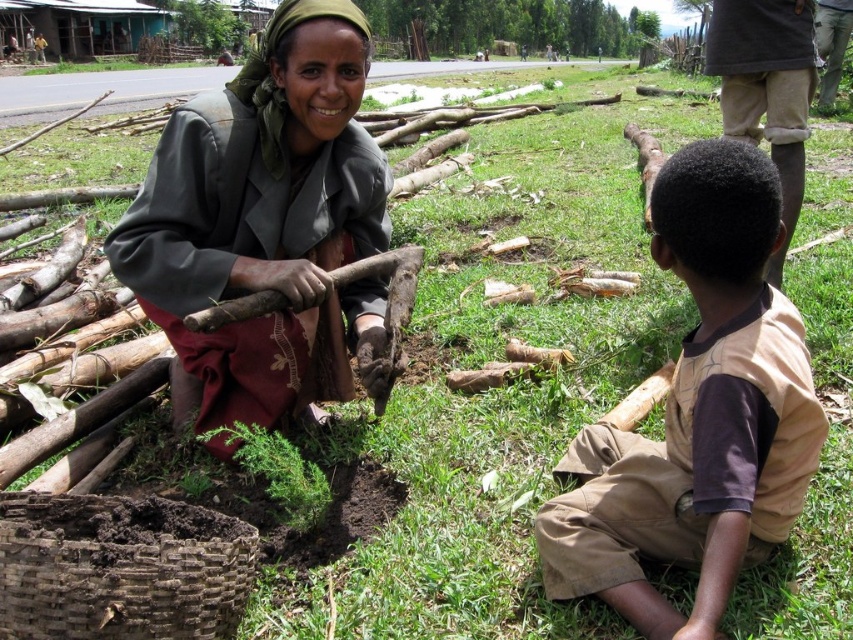
Is point (729, 541) positioned in front of point (93, 508)?

Yes.

The width and height of the screenshot is (853, 640). Describe the element at coordinates (698, 413) in the screenshot. I see `brown cotton shirt at center` at that location.

Identify the location of brown cotton shirt at center. Image resolution: width=853 pixels, height=640 pixels. (698, 413).

Between dark gray fabric at center and brown cotton shirt at center, which one has more height?

dark gray fabric at center is taller.

Where is `dark gray fabric at center`? dark gray fabric at center is located at coordinates (265, 225).

Who is positioned more to the right, dark gray fabric at center or brown woven basket at lower left?

dark gray fabric at center is more to the right.

Can you confirm if dark gray fabric at center is thinner than brown woven basket at lower left?

No, dark gray fabric at center is not thinner than brown woven basket at lower left.

Image resolution: width=853 pixels, height=640 pixels. Describe the element at coordinates (265, 225) in the screenshot. I see `dark gray fabric at center` at that location.

The height and width of the screenshot is (640, 853). I want to click on dark gray fabric at center, so click(x=265, y=225).